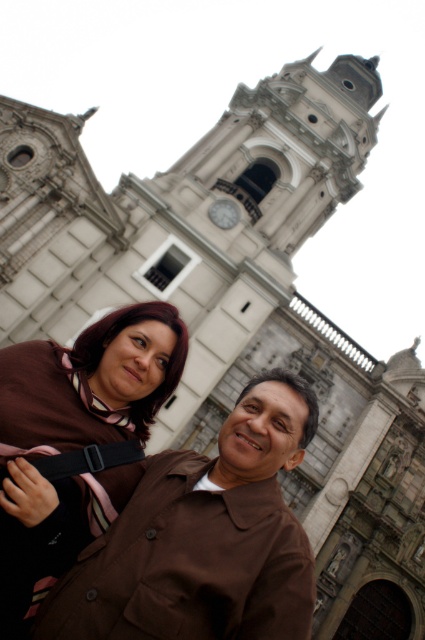
Question: Which of the following is the farthest from the observer?

Choices:
 (A) (181, 592)
 (B) (85, 348)
 (C) (181, 356)
 (D) (300, 385)

Answer: (C)

Question: Can you confirm if brown matte jacket at center is bigger than brown fabric at center?

Choices:
 (A) yes
 (B) no

Answer: (A)

Question: Is brown fabric at lower left to the right of brown fabric at center from the viewer's perspective?

Choices:
 (A) no
 (B) yes

Answer: (A)

Question: Based on their relative distances, which object is farther from the brown fabric at center?

Choices:
 (A) matte brown jacket at lower center
 (B) brown matte jacket at center
 (C) brown fabric at lower left

Answer: (B)

Question: Can you confirm if brown matte jacket at center is smaller than brown fabric at center?

Choices:
 (A) no
 (B) yes

Answer: (A)

Question: Which is nearer to the matte brown jacket at lower center?

Choices:
 (A) brown fabric at lower left
 (B) brown matte jacket at center

Answer: (B)